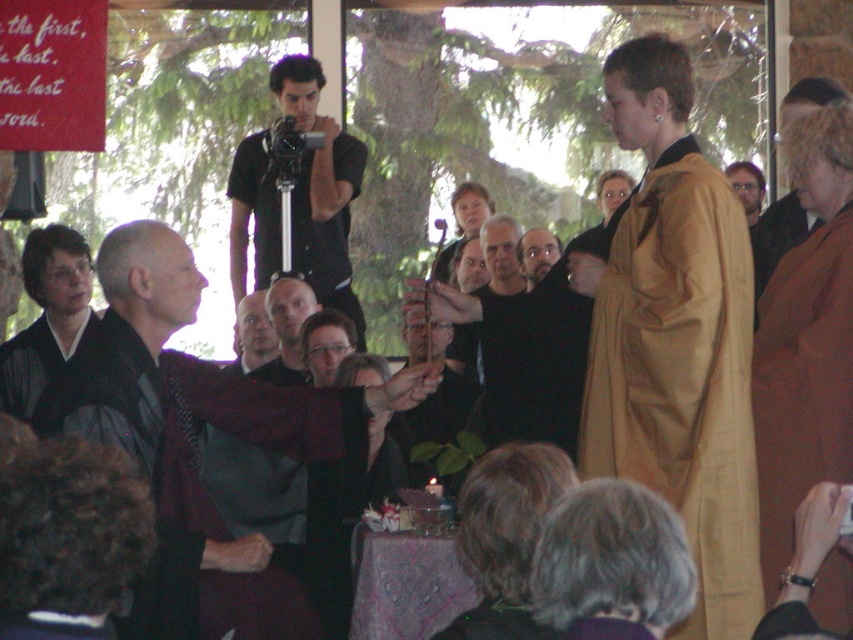
Question: Among these points, which one is farthest from the camera?

Choices:
 (A) (703, 513)
 (B) (554, 323)

Answer: (B)

Question: Does maroon silk robe at center have a lesser width compared to maroon velvet robe at center?

Choices:
 (A) no
 (B) yes

Answer: (A)

Question: Is golden silk robe at center wider than brown woolen robe at right?

Choices:
 (A) no
 (B) yes

Answer: (B)

Question: Considering the relative positions of brown woolen robe at right and black matte violin at center in the image provided, where is brown woolen robe at right located with respect to black matte violin at center?

Choices:
 (A) below
 (B) above

Answer: (A)

Question: Which of the following is the farthest from the observer?

Choices:
 (A) click(x=834, y=481)
 (B) click(x=669, y=636)
 (C) click(x=285, y=372)
 (D) click(x=201, y=358)

Answer: (C)

Question: Among these objects, which one is farthest from the camera?

Choices:
 (A) black matte camera at center
 (B) smooth black shirt at center
 (C) maroon velvet robe at center
 (D) black matte violin at center

Answer: (A)